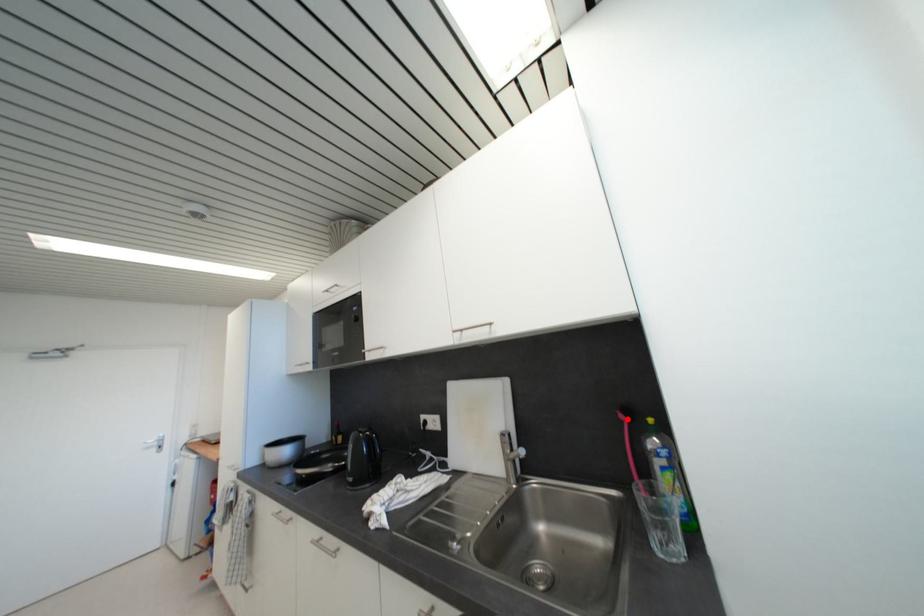
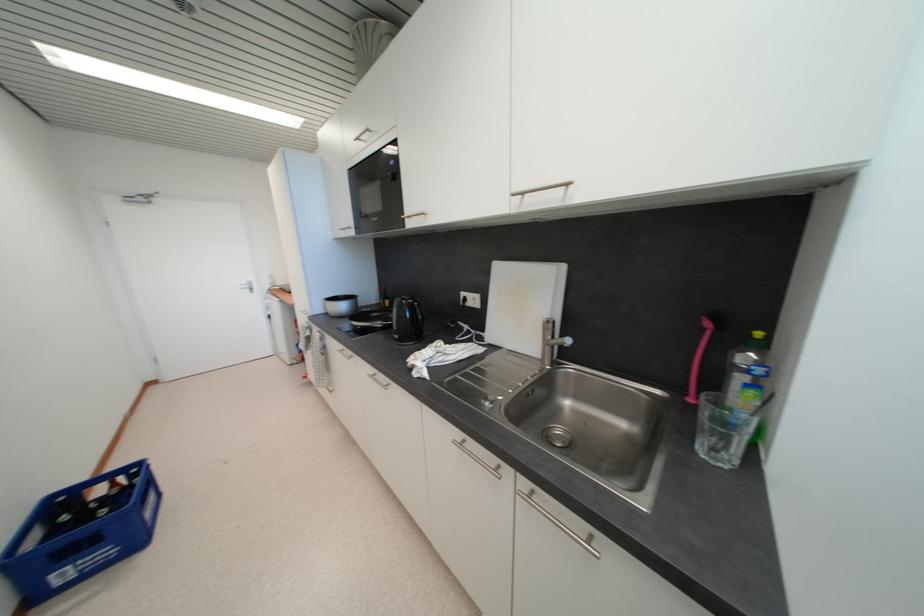
Locate, in the second image, the point that corresponds to the highlighted location in the first image.

(713, 326)